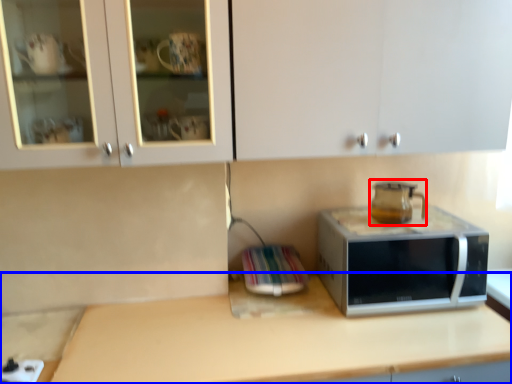
Question: Which of the following is the farthest to the observer, coffeepot (highlighted by a red box) or countertop (highlighted by a blue box)?

Choices:
 (A) coffeepot
 (B) countertop

Answer: (A)